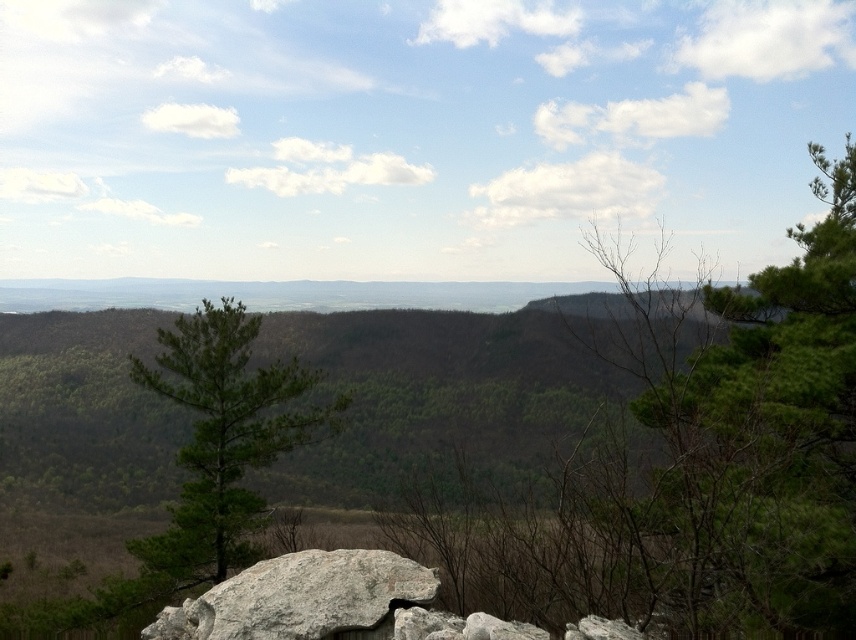
You are an environmental scientist assessing the health of the landscape. You notice two trees at the center of the image, a green leafy tree at center and a green matte tree at center. Which tree appears to be more robust in terms of foliage density?

The green leafy tree at center has a larger size compared to the green matte tree at center, indicating it has a more robust foliage density.

You are standing at the origin point in the landscape. Which direction should you walk to reach the green matte tree at center?

The green matte tree at center is located at coordinates point (223, 440), so you should walk northeast to reach it.

You are standing at the base of the gray rough rock at lower center and want to walk towards the green leafy tree at center. Which direction should you head?

You should head to the right because the green leafy tree at center is to the right of the gray rough rock at lower center.